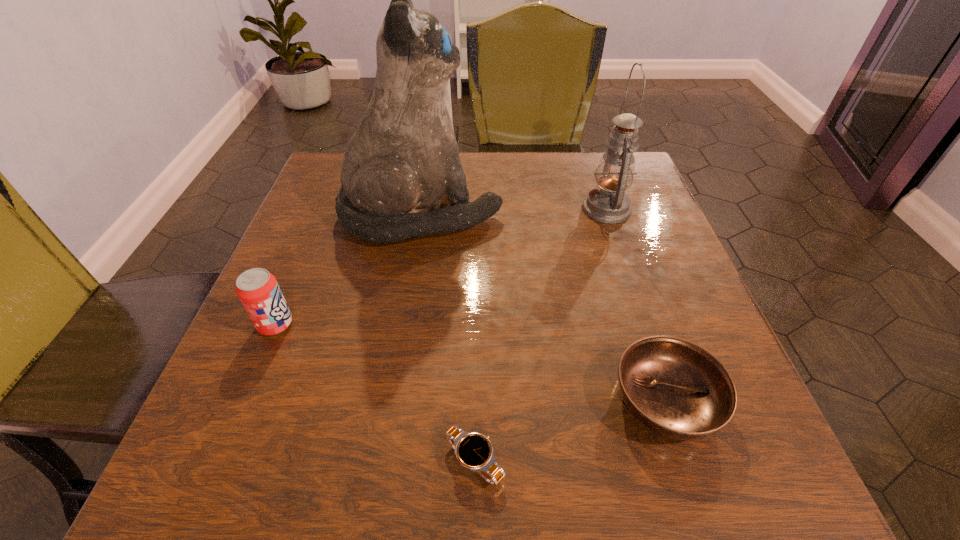
At what (x,y) coordinates should I click in order to perform the action: click on object at the far right corner. Please return your answer as a coordinate pair (x, y). This screenshot has width=960, height=540. Looking at the image, I should click on (608, 203).

Locate an element on the screen. This screenshot has width=960, height=540. object located at the near right corner is located at coordinates (674, 387).

This screenshot has height=540, width=960. In order to click on vacant space at the far edge of the desktop in this screenshot , I will do `click(492, 180)`.

Image resolution: width=960 pixels, height=540 pixels. I want to click on free spot at the near edge of the desktop, so click(x=331, y=462).

This screenshot has width=960, height=540. I want to click on vacant space at the left edge, so click(269, 337).

Find the location of a particular element. free space at the right edge is located at coordinates (625, 348).

Locate an element on the screen. vacant space at the near right corner of the desktop is located at coordinates [x=692, y=447].

This screenshot has height=540, width=960. I want to click on free spot between the third nearest object and the cat, so click(x=348, y=269).

Locate an element on the screen. Image resolution: width=960 pixels, height=540 pixels. empty location between the watch and the fourth tallest object is located at coordinates (570, 431).

Where is `free space between the third shortest object and the second shortest object`? The width and height of the screenshot is (960, 540). free space between the third shortest object and the second shortest object is located at coordinates (470, 362).